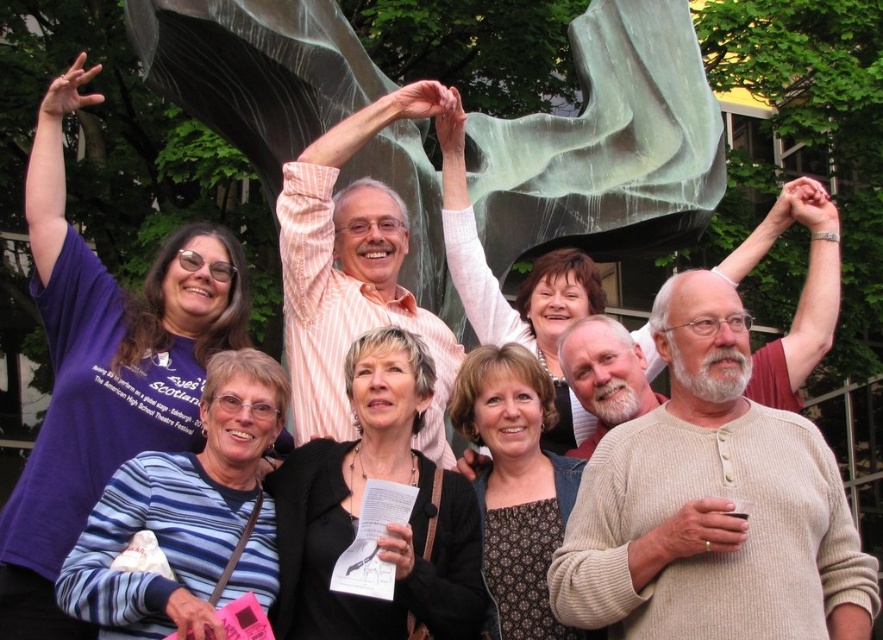
Who is lower down, matte white blouse at center or patterned fabric dress at center?

patterned fabric dress at center is below.

In the scene shown: Who is higher up, matte white blouse at center or patterned fabric dress at center?

matte white blouse at center

This screenshot has width=883, height=640. I want to click on matte white blouse at center, so click(521, 284).

Which is above, purple cotton shirt at upper left or black matte jacket at center?

purple cotton shirt at upper left is higher up.

Between point (65, 340) and point (336, 557), which one is positioned behind?

Positioned behind is point (65, 340).

At what (x,y) coordinates should I click in order to perform the action: click on purple cotton shirt at upper left. Please return your answer as a coordinate pair (x, y). This screenshot has height=640, width=883. Looking at the image, I should click on (104, 369).

Is purple cotton shirt at upper left positioned at the back of blue striped sweater at lower left?

Yes, purple cotton shirt at upper left is further from the viewer.

Between purple cotton shirt at upper left and blue striped sweater at lower left, which one appears on the left side from the viewer's perspective?

Positioned to the left is purple cotton shirt at upper left.

The height and width of the screenshot is (640, 883). What do you see at coordinates (104, 369) in the screenshot? I see `purple cotton shirt at upper left` at bounding box center [104, 369].

Identify the location of purple cotton shirt at upper left. Image resolution: width=883 pixels, height=640 pixels. (x=104, y=369).